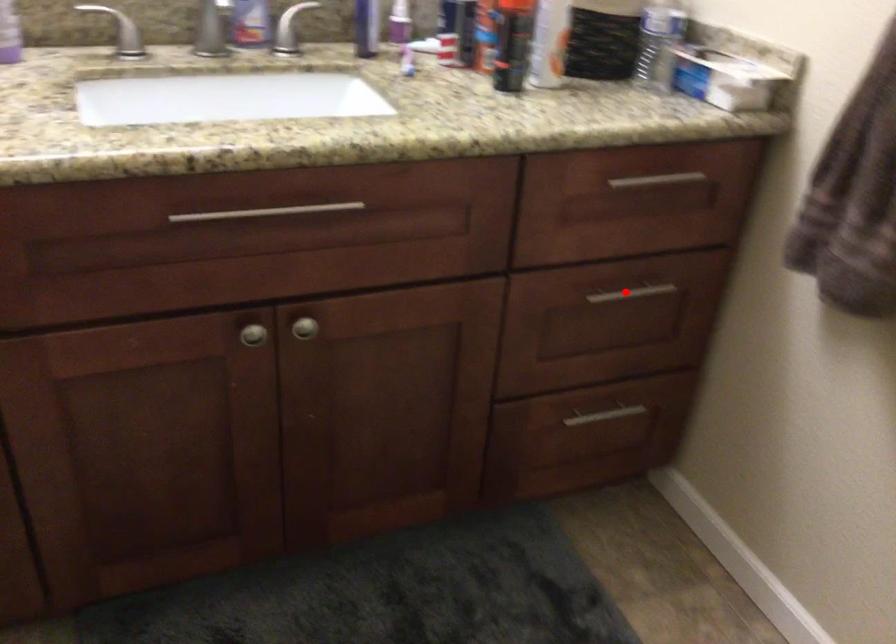
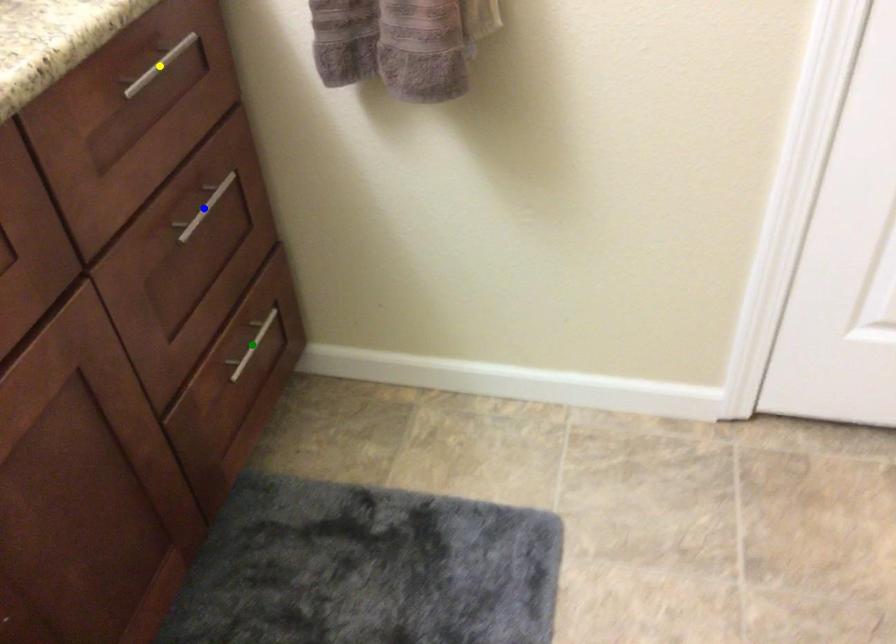
Question: I am providing you with two images of the same scene from different viewpoints. A red point is marked on the first image. You are given multiple points on the second image. Which spot in image 2 lines up with the point in image 1?

Choices:
 (A) green point
 (B) yellow point
 (C) blue point

Answer: (C)